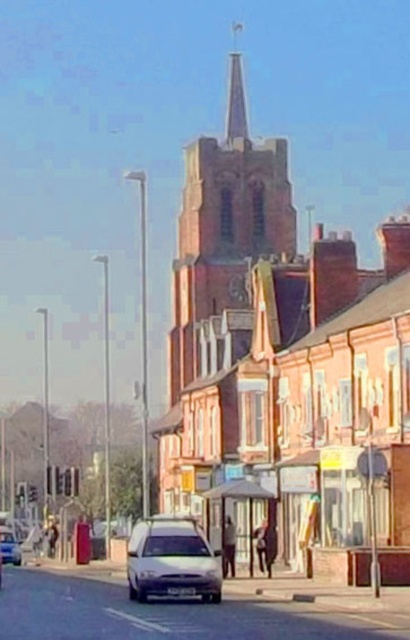
What are the coordinates of the silver metallic van at center?

The silver metallic van at center is located at coordinates point [172,561].

You are a pedestrian standing at the crosswalk near the white matte car at lower left. You need to reach a store located near the silver metallic van at center. Given that the safe walking distance for pedestrians is 20 meters, can you safely walk to the store without needing to cross any roads?

The distance between the silver metallic van at center and the white matte car at lower left is 17.73 meters, which is within the safe walking distance of 20 meters. Therefore, you can safely walk to the store without crossing any roads.

You are a photographer trying to capture a wide shot of the brick church steeple at center while also including the white matte car at center in the frame. Considering their sizes, which object will occupy more space in your photo?

The brick church steeple at center will occupy more space in the photo because its width is larger than that of the white matte car at center.